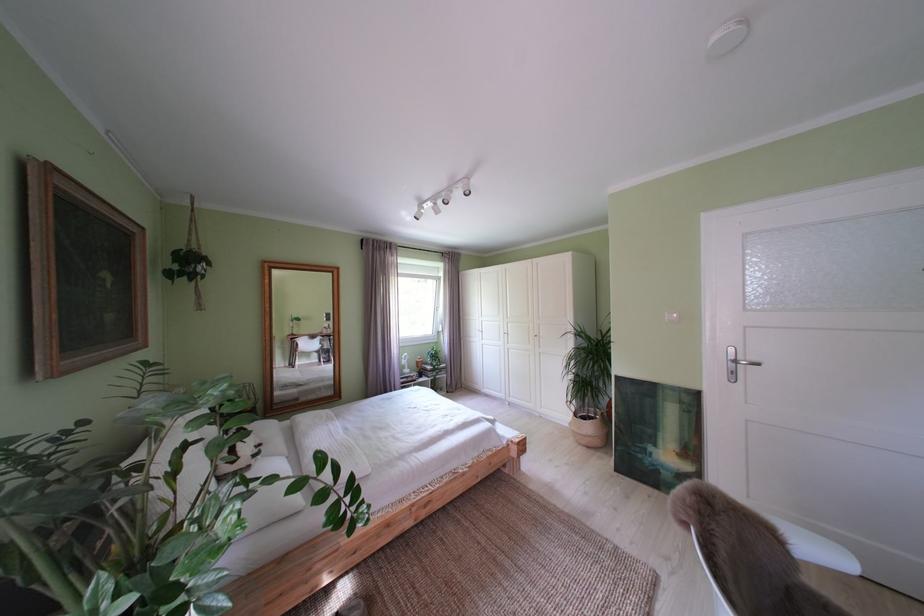
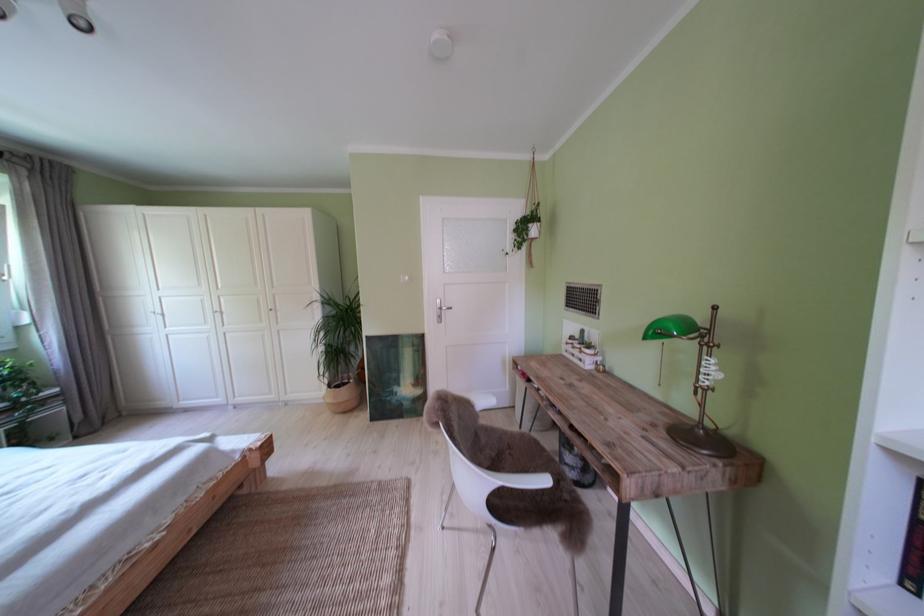
Question: Based on the continuous images, in which direction is the camera rotating? Reply with the corresponding letter.

Choices:
 (A) Left
 (B) Right
 (C) Up
 (D) Down

Answer: (B)